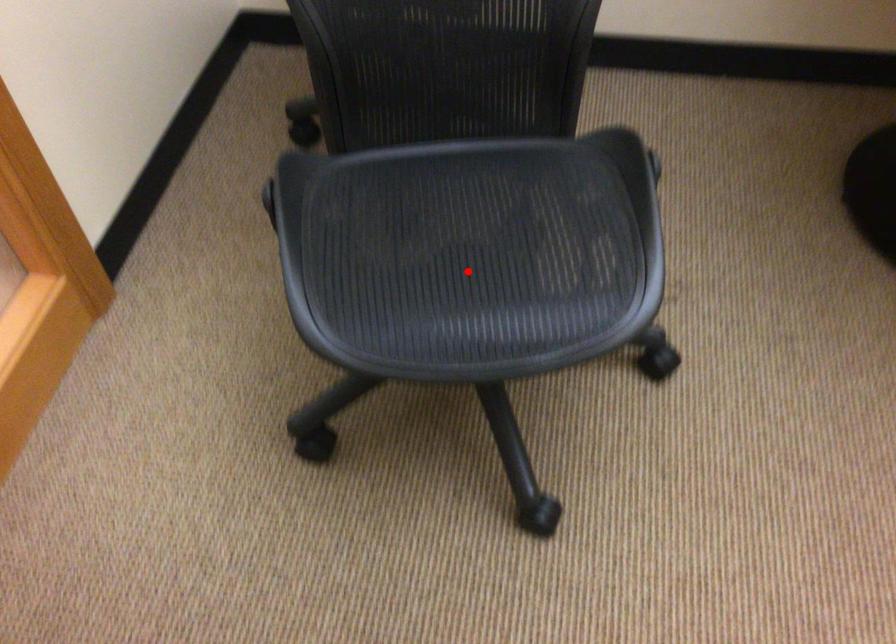
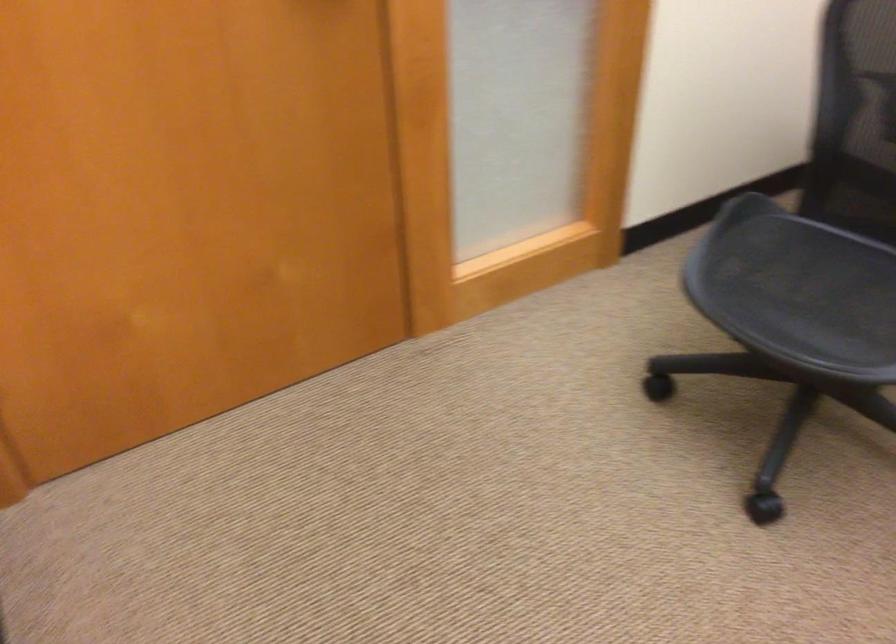
Where in the second image is the point corresponding to the highlighted location from the first image?

(805, 295)